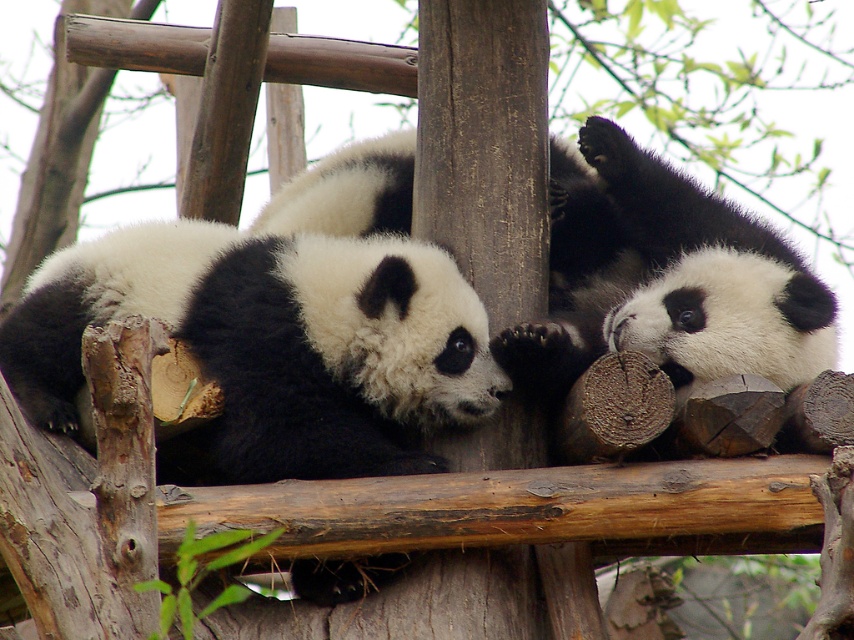
Question: Can you confirm if black and white fur panda at center is positioned to the left of black fuzzy panda at center?

Choices:
 (A) no
 (B) yes

Answer: (B)

Question: Can you confirm if black and white fur panda at center is positioned below black fuzzy panda at center?

Choices:
 (A) no
 (B) yes

Answer: (B)

Question: Among these objects, which one is farthest from the camera?

Choices:
 (A) black and white fur panda at center
 (B) black fuzzy panda at center

Answer: (A)

Question: Can you confirm if black and white fur panda at center is wider than black fuzzy panda at center?

Choices:
 (A) yes
 (B) no

Answer: (A)